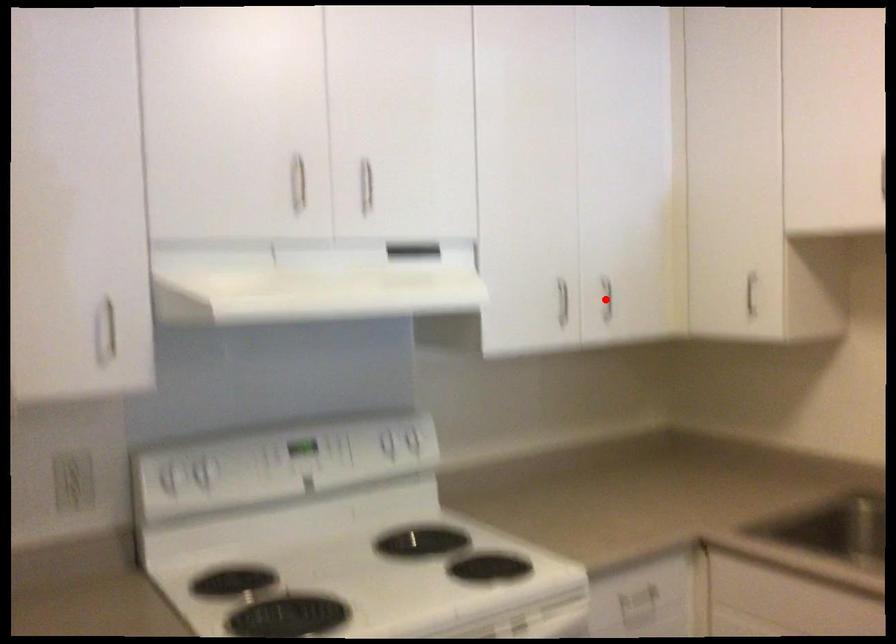
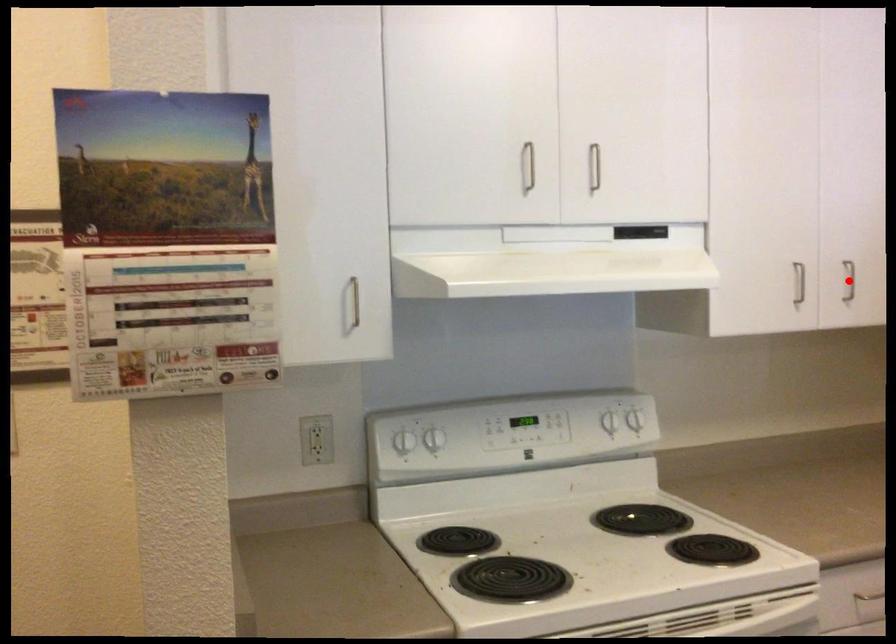
I am providing you with two images of the same scene from different viewpoints. A red point is marked on the first image and another point is marked on the second image. Are the points marked in image1 and image2 representing the same 3D position?

Yes